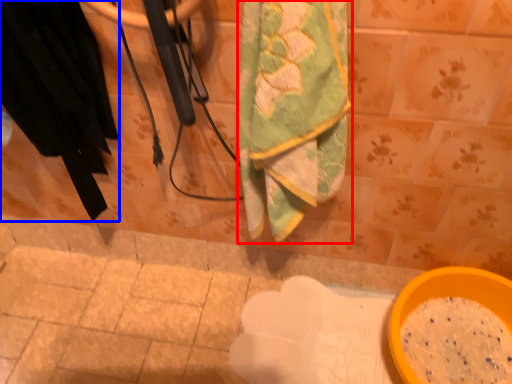
Question: Which object is closer to the camera taking this photo, towel (highlighted by a red box) or clothing (highlighted by a blue box)?

Choices:
 (A) towel
 (B) clothing

Answer: (A)